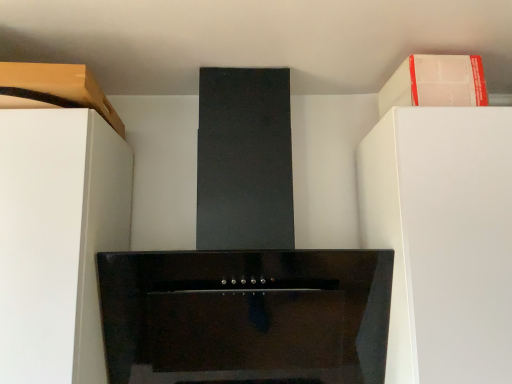
Question: From the image's perspective, is white matte cabinet at left located above or below matte wood cabinet at upper left, placed as the 2th cabinetry when sorted from right to left?

Choices:
 (A) above
 (B) below

Answer: (B)

Question: Is white matte cabinet at left in front of or behind matte wood cabinet at upper left, placed as the 2th cabinetry when sorted from right to left, in the image?

Choices:
 (A) front
 (B) behind

Answer: (A)

Question: Based on their relative distances, which object is farther from the white matte cabinet at upper right, the 2th cabinetry when ordered from left to right?

Choices:
 (A) matte wood cabinet at upper left, which is counted as the first cabinetry, starting from the left
 (B) white matte cabinet at left

Answer: (B)

Question: Which object is the farthest from the matte wood cabinet at upper left, placed as the 2th cabinetry when sorted from right to left?

Choices:
 (A) white matte cabinet at left
 (B) white matte cabinet at upper right, the 2th cabinetry when ordered from left to right

Answer: (B)